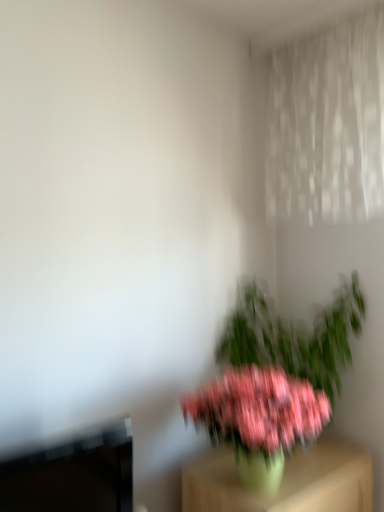
Question: Is pink matte flower at center at the right side of pink matte plant at center?

Choices:
 (A) yes
 (B) no

Answer: (B)

Question: Is pink matte plant at center at the back of pink matte flower at center?

Choices:
 (A) no
 (B) yes

Answer: (A)

Question: Would you say pink matte flower at center is outside pink matte plant at center?

Choices:
 (A) yes
 (B) no

Answer: (A)

Question: From the image's perspective, does pink matte flower at center appear lower than pink matte plant at center?

Choices:
 (A) yes
 (B) no

Answer: (A)

Question: Does pink matte flower at center lie in front of pink matte plant at center?

Choices:
 (A) no
 (B) yes

Answer: (B)

Question: Could you tell me if pink matte flower at center is turned towards pink matte plant at center?

Choices:
 (A) yes
 (B) no

Answer: (B)

Question: Is pink matte plant at center thinner than green matte vase at lower right?

Choices:
 (A) no
 (B) yes

Answer: (B)

Question: From the image's perspective, is pink matte plant at center over green matte vase at lower right?

Choices:
 (A) no
 (B) yes

Answer: (B)

Question: From a real-world perspective, is pink matte plant at center on green matte vase at lower right?

Choices:
 (A) no
 (B) yes

Answer: (B)

Question: Can you confirm if pink matte plant at center is shorter than green matte vase at lower right?

Choices:
 (A) yes
 (B) no

Answer: (B)

Question: Is pink matte plant at center not close to green matte vase at lower right?

Choices:
 (A) yes
 (B) no

Answer: (B)

Question: Is pink matte plant at center touching green matte vase at lower right?

Choices:
 (A) no
 (B) yes

Answer: (A)

Question: Is pink matte plant at center shorter than pink matte flower at center?

Choices:
 (A) no
 (B) yes

Answer: (A)